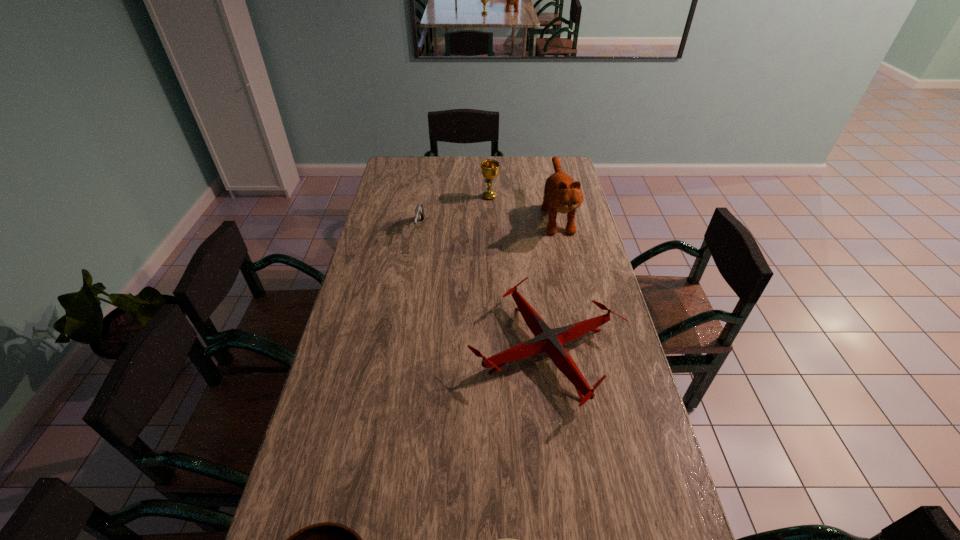
I want to click on drone situated at the right edge, so click(x=548, y=340).

Identify the location of free space at the far edge of the desktop. (445, 161).

Identify the location of free space at the left edge of the desktop. The image size is (960, 540). (391, 242).

Image resolution: width=960 pixels, height=540 pixels. Identify the location of free location at the right edge. (582, 249).

The width and height of the screenshot is (960, 540). Identify the location of vacant area that lies between the third nearest object and the gun. (484, 289).

Identify the location of vacant region between the second shortest object and the tallest object. (552, 282).

Where is `vacant area that lies between the fifth tallest object and the cat`? This screenshot has height=540, width=960. vacant area that lies between the fifth tallest object and the cat is located at coordinates (552, 282).

Image resolution: width=960 pixels, height=540 pixels. In order to click on free space between the gun and the drone in this screenshot , I will do `click(484, 289)`.

Identify the location of free space that is in between the fifth shortest object and the fourth farthest object. The image size is (960, 540). (518, 274).

Identify the location of object that is the third nearest to the shortest object. (419, 211).